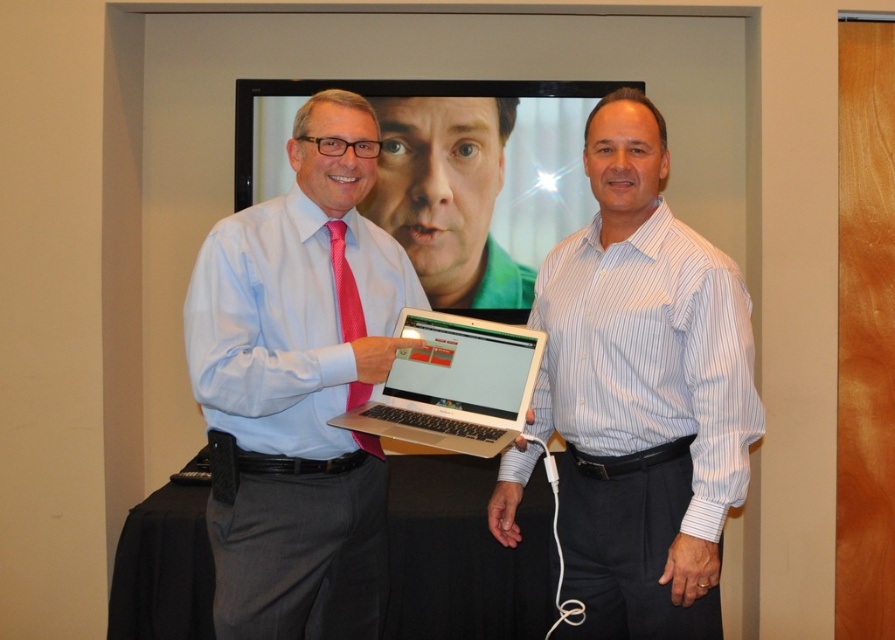
Can you confirm if white striped shirt at center is positioned to the right of silver metallic laptop at center?

Indeed, white striped shirt at center is positioned on the right side of silver metallic laptop at center.

Between white striped shirt at center and silver metallic laptop at center, which one is positioned higher?

white striped shirt at center is above.

What do you see at coordinates (644, 392) in the screenshot? I see `white striped shirt at center` at bounding box center [644, 392].

Where is `white striped shirt at center`? white striped shirt at center is located at coordinates (644, 392).

Between matte pink tie at center and silver metallic laptop at center, which one appears on the left side from the viewer's perspective?

Positioned to the left is matte pink tie at center.

Measure the distance from matte pink tie at center to silver metallic laptop at center.

matte pink tie at center is 6.87 inches away from silver metallic laptop at center.

You are a GUI agent. You are given a task and a screenshot of the screen. Output one action in this format:
    pyautogui.click(x=<x>, y=<y>)
    Task: Click on the matte pink tie at center
    The width and height of the screenshot is (895, 640).
    Given the screenshot: What is the action you would take?
    pyautogui.click(x=299, y=387)

Which is below, white striped shirt at center or matte pink tie at center?

white striped shirt at center

Is white striped shirt at center closer to the viewer compared to matte pink tie at center?

No.

Identify the location of white striped shirt at center. (644, 392).